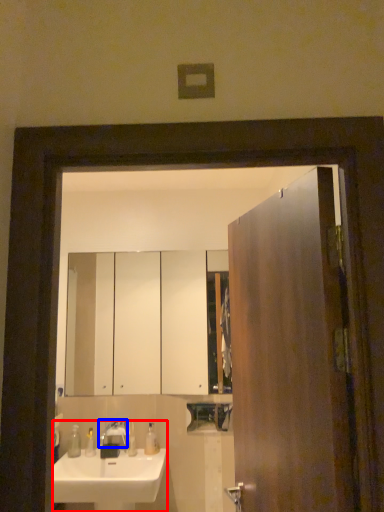
Question: Among these objects, which one is farthest to the camera, sink (highlighted by a red box) or tap (highlighted by a blue box)?

Choices:
 (A) sink
 (B) tap

Answer: (B)